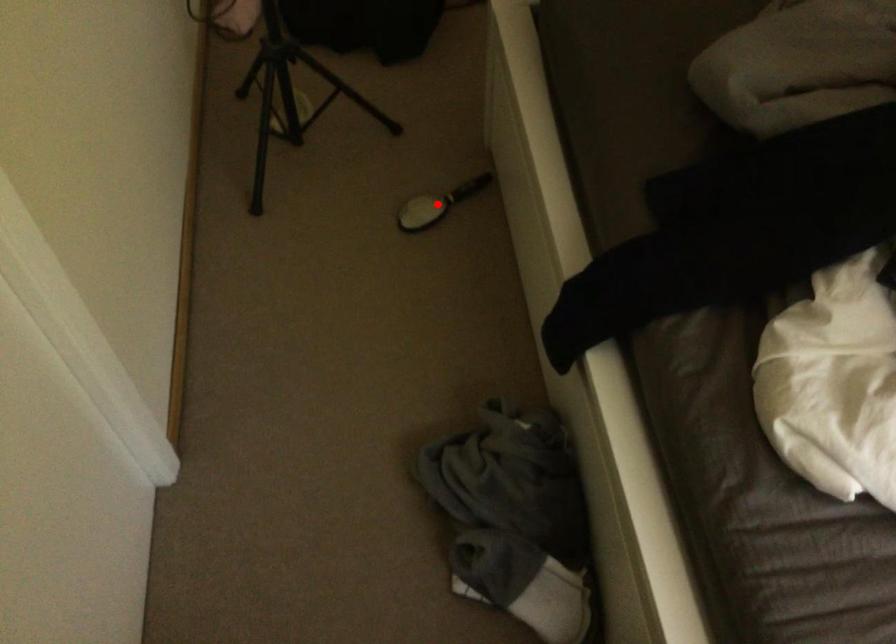
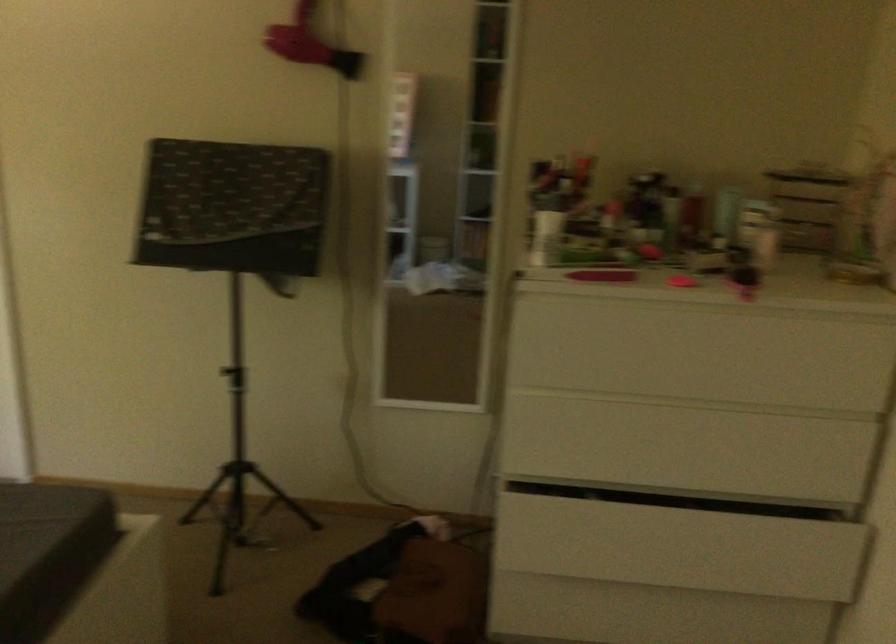
Question: I am providing you with two images of the same scene from different viewpoints. A red point is marked on the first image. Is the red point's position out of view in image 2?

Choices:
 (A) Yes
 (B) No

Answer: (A)